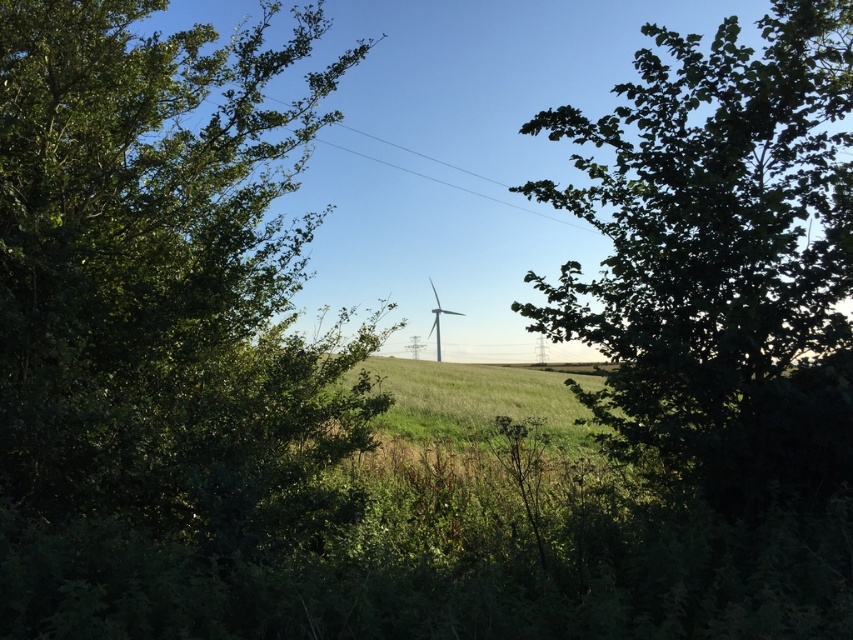
Question: Which point is farther from the camera taking this photo?

Choices:
 (A) (381, 392)
 (B) (822, 52)
 (C) (437, 324)

Answer: (A)

Question: Among these objects, which one is nearest to the camera?

Choices:
 (A) green leafy tree at left
 (B) green leafy tree at center
 (C) white matte wind turbine at center

Answer: (A)

Question: Is green leafy tree at left bigger than green leafy tree at center?

Choices:
 (A) yes
 (B) no

Answer: (A)

Question: Which point is closer to the camera?

Choices:
 (A) green leafy tree at left
 (B) white matte wind turbine at center
 (C) green leafy tree at center

Answer: (A)

Question: Is green leafy tree at center smaller than white matte wind turbine at center?

Choices:
 (A) no
 (B) yes

Answer: (A)

Question: In this image, where is green leafy tree at left located relative to white matte wind turbine at center?

Choices:
 (A) left
 (B) right

Answer: (A)